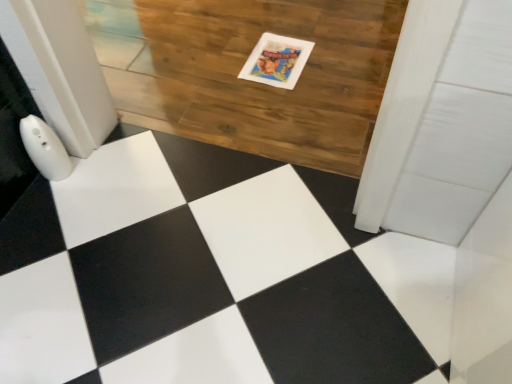
Question: In terms of height, does wooden floor at center look taller or shorter compared to matte paper postcard at upper center?

Choices:
 (A) short
 (B) tall

Answer: (B)

Question: Would you say wooden floor at center is to the left or to the right of matte paper postcard at upper center in the picture?

Choices:
 (A) right
 (B) left

Answer: (B)

Question: From the image's perspective, is wooden floor at center above or below matte paper postcard at upper center?

Choices:
 (A) above
 (B) below

Answer: (A)

Question: Considering the positions of matte paper postcard at upper center and wooden floor at center in the image, is matte paper postcard at upper center taller or shorter than wooden floor at center?

Choices:
 (A) tall
 (B) short

Answer: (B)

Question: Is matte paper postcard at upper center in front of or behind wooden floor at center in the image?

Choices:
 (A) front
 (B) behind

Answer: (B)

Question: Looking at their shapes, would you say matte paper postcard at upper center is wider or thinner than wooden floor at center?

Choices:
 (A) wide
 (B) thin

Answer: (B)

Question: Based on their positions, is matte paper postcard at upper center located to the left or right of wooden floor at center?

Choices:
 (A) left
 (B) right

Answer: (B)